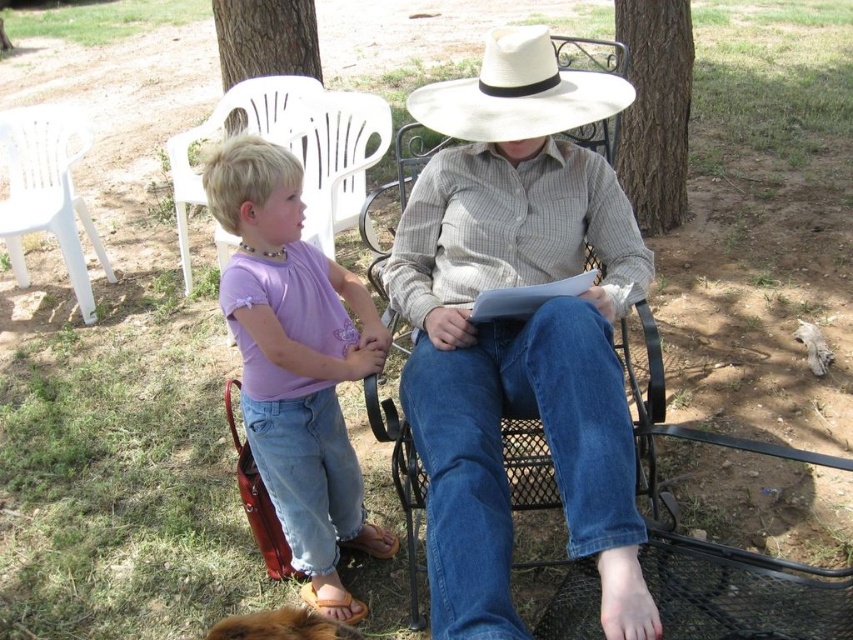
Question: Does purple cotton shirt at left lie in front of white plastic chair at lower left?

Choices:
 (A) no
 (B) yes

Answer: (B)

Question: Estimate the real-world distances between objects in this image. Which object is closer to the matte brown shirt at center?

Choices:
 (A) purple cotton shirt at left
 (B) white felt cowboy hat at center
 (C) white plastic chair at lower left

Answer: (B)

Question: Among these points, which one is farthest from the camera?

Choices:
 (A) (16, 125)
 (B) (244, 163)
 (C) (413, 93)

Answer: (A)

Question: Which object is the farthest from the white plastic chair at lower left?

Choices:
 (A) white felt cowboy hat at center
 (B) purple cotton shirt at left

Answer: (A)

Question: Can you confirm if matte brown shirt at center is wider than white felt cowboy hat at center?

Choices:
 (A) yes
 (B) no

Answer: (A)

Question: Is white felt cowboy hat at center wider than white plastic chair at lower left?

Choices:
 (A) no
 (B) yes

Answer: (A)